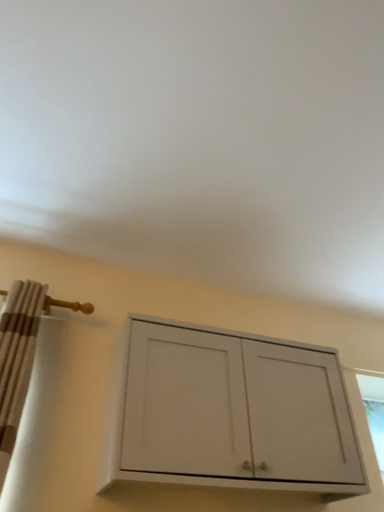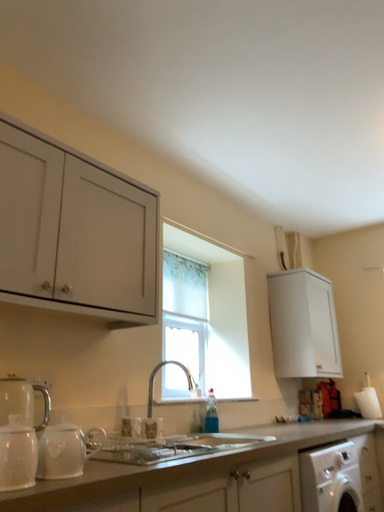
Question: How did the camera likely rotate when shooting the video?

Choices:
 (A) rotated right
 (B) rotated left

Answer: (A)